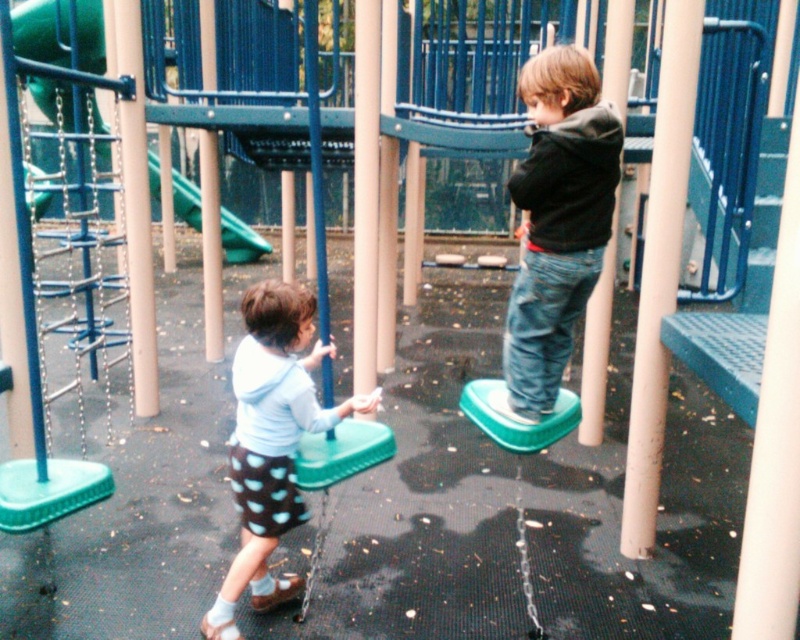
Question: Among these objects, which one is farthest from the camera?

Choices:
 (A) green plastic swing at center
 (B) white matte shirt at center
 (C) green rubber slide at upper left
 (D) dark gray hoodie at center

Answer: (C)

Question: Which point is closer to the camera taking this photo?

Choices:
 (A) (264, 253)
 (B) (240, 400)

Answer: (B)

Question: Does dark gray hoodie at center have a larger size compared to white matte shirt at center?

Choices:
 (A) yes
 (B) no

Answer: (B)

Question: Among these objects, which one is nearest to the camera?

Choices:
 (A) green plastic swing at center
 (B) green rubber slide at upper left

Answer: (A)

Question: In this image, where is green plastic swing at center located relative to green rubber slide at upper left?

Choices:
 (A) below
 (B) above

Answer: (A)

Question: Does dark gray hoodie at center appear on the left side of white matte shirt at center?

Choices:
 (A) yes
 (B) no

Answer: (B)